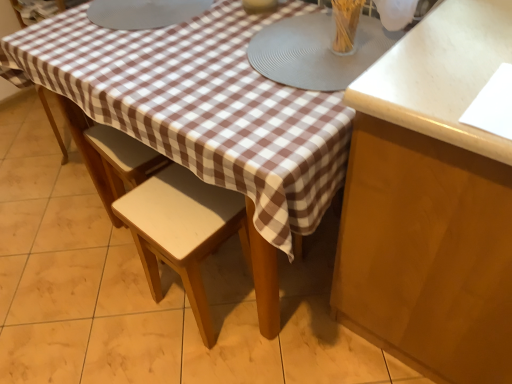
What are the coordinates of `free area below light beige wood stool at center (from a real-world perspective)` in the screenshot? It's located at (215, 295).